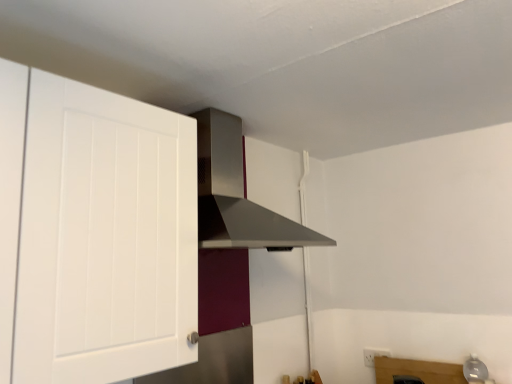
Question: Looking at the image, does white matte cabinet at left seem bigger or smaller compared to satin silver vent at upper center?

Choices:
 (A) big
 (B) small

Answer: (B)

Question: Does point (16, 64) appear closer or farther from the camera than point (243, 173)?

Choices:
 (A) farther
 (B) closer

Answer: (B)

Question: From a real-world perspective, is white matte cabinet at left above or below satin silver vent at upper center?

Choices:
 (A) above
 (B) below

Answer: (B)

Question: Considering the positions of satin silver vent at upper center and white matte cabinet at left in the image, is satin silver vent at upper center bigger or smaller than white matte cabinet at left?

Choices:
 (A) big
 (B) small

Answer: (A)

Question: In the image, is satin silver vent at upper center positioned in front of or behind white matte cabinet at left?

Choices:
 (A) behind
 (B) front

Answer: (A)

Question: From their relative heights in the image, would you say satin silver vent at upper center is taller or shorter than white matte cabinet at left?

Choices:
 (A) tall
 (B) short

Answer: (B)

Question: From the image's perspective, is satin silver vent at upper center above or below white matte cabinet at left?

Choices:
 (A) below
 (B) above

Answer: (B)